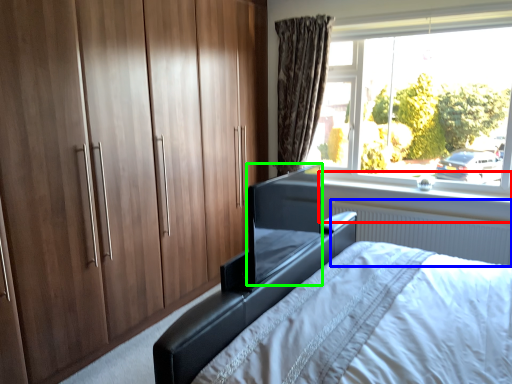
Question: Considering the real-world distances, which object is closest to window sill (highlighted by a red box)? radiator (highlighted by a blue box) or window screen (highlighted by a green box).

Choices:
 (A) radiator
 (B) window screen

Answer: (A)